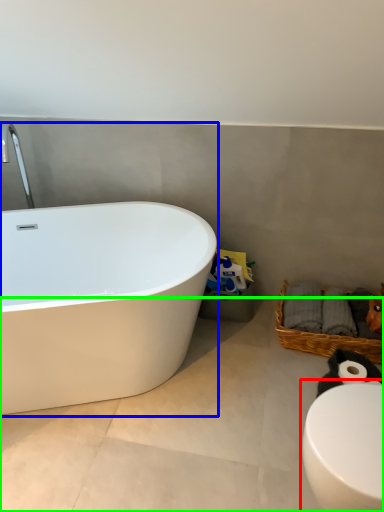
Question: Which is farther away from toilet (highlighted by a red box)? bathtub (highlighted by a blue box) or concrete (highlighted by a green box)?

Choices:
 (A) bathtub
 (B) concrete

Answer: (A)